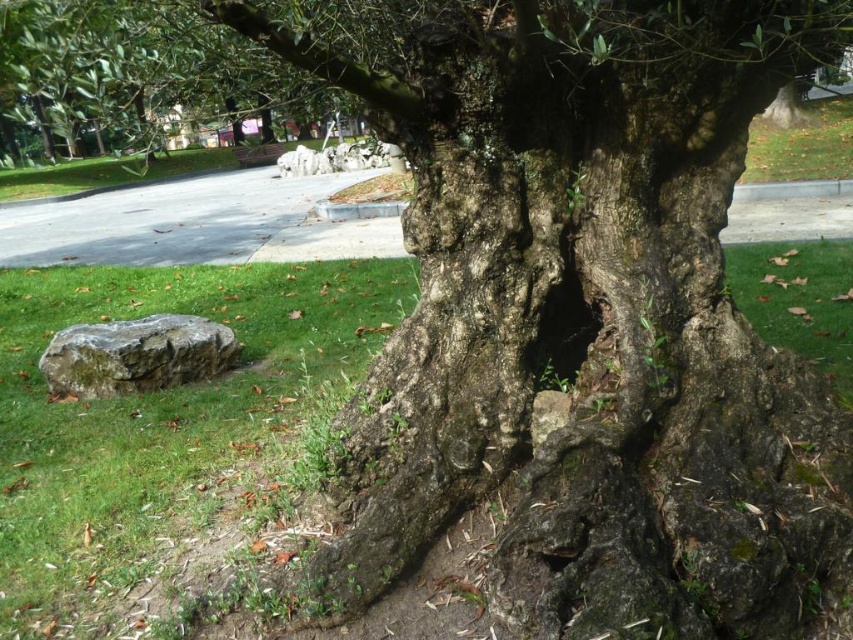
Question: Does green mossy rock at lower left appear under dark rough hole at center?

Choices:
 (A) no
 (B) yes

Answer: (B)

Question: Considering the real-world distances, which object is farthest from the green mossy rock at lower left?

Choices:
 (A) dark rough hole at center
 (B) green grass at lower left

Answer: (A)

Question: Is green mossy rock at lower left to the left of dark rough hole at center from the viewer's perspective?

Choices:
 (A) no
 (B) yes

Answer: (B)

Question: Which of the following is the farthest from the observer?

Choices:
 (A) (161, 387)
 (B) (549, 333)
 (C) (268, 355)

Answer: (C)

Question: Can you confirm if green mossy rock at lower left is positioned below dark rough hole at center?

Choices:
 (A) yes
 (B) no

Answer: (A)

Question: Which point is farther to the camera?

Choices:
 (A) dark rough hole at center
 (B) green grass at lower left

Answer: (A)